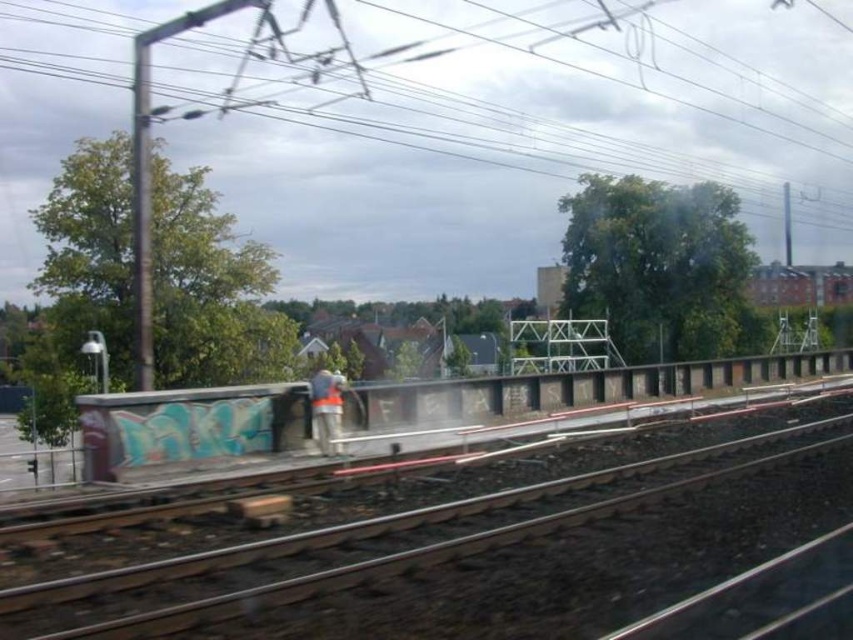
You are a maintenance worker on the railway. You need to reach both the metallic wire at upper center and the metal track at center. Which object will require you to look upward more?

The metallic wire at upper center has a greater height compared to the metal track at center, so you will need to look upward more to reach the metallic wire at upper center.

You are a railway inspector standing at the scene. You need to compare the size of the metal track at center and the orange reflective vest at center. Which object takes up more space in the image?

The orange reflective vest at center takes up more space in the image than the metal track at center, as the metal track at center occupies less space than orange reflective vest at center.